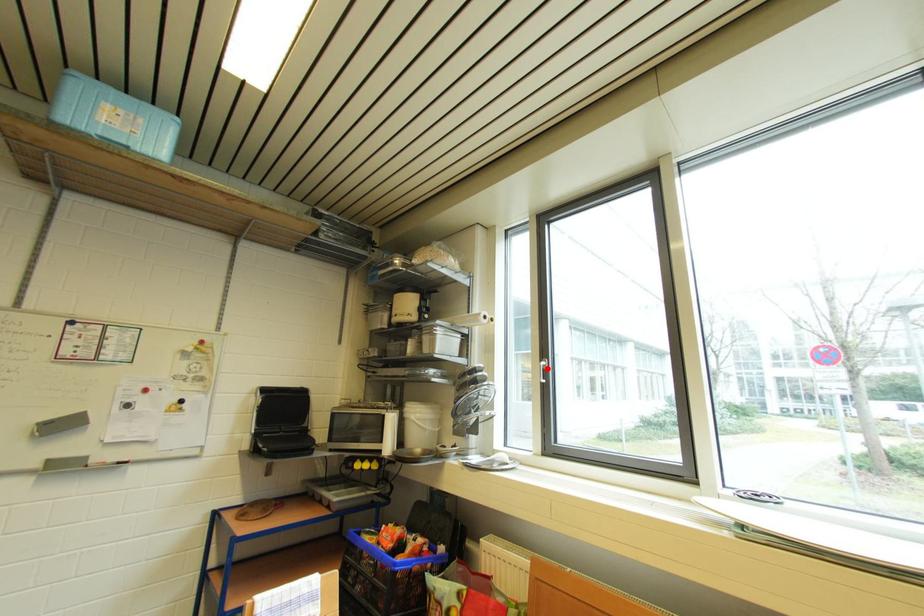
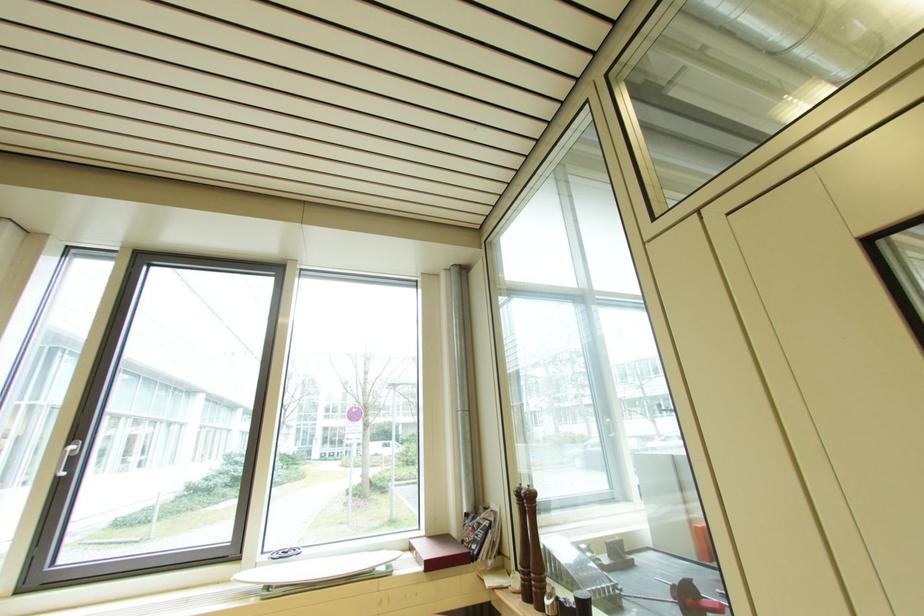
Question: I am providing you with two images of the same scene from different viewpoints. A red point is shown in image1. For the corresponding object point in image2, is it positioned nearer or farther from the camera?

Choices:
 (A) Nearer
 (B) Farther

Answer: (A)